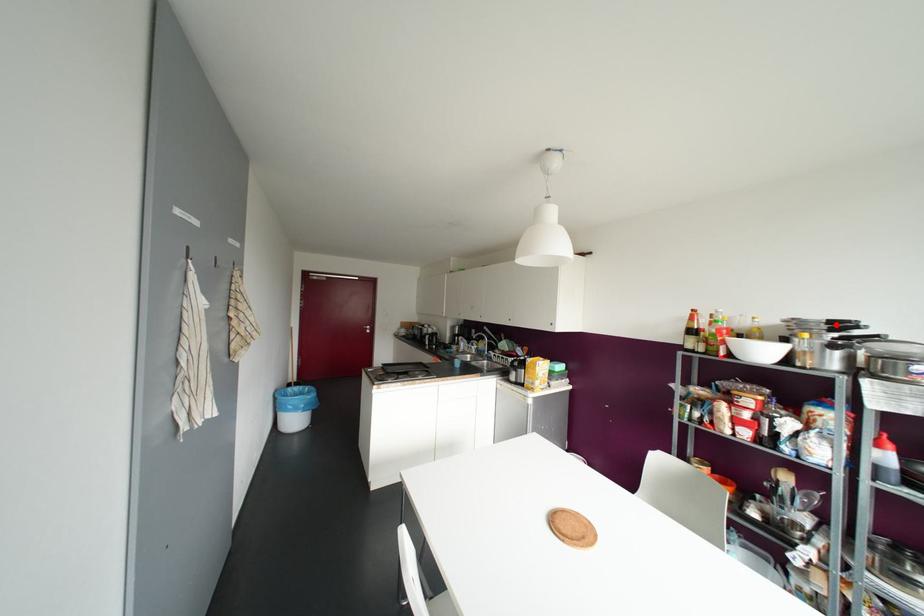
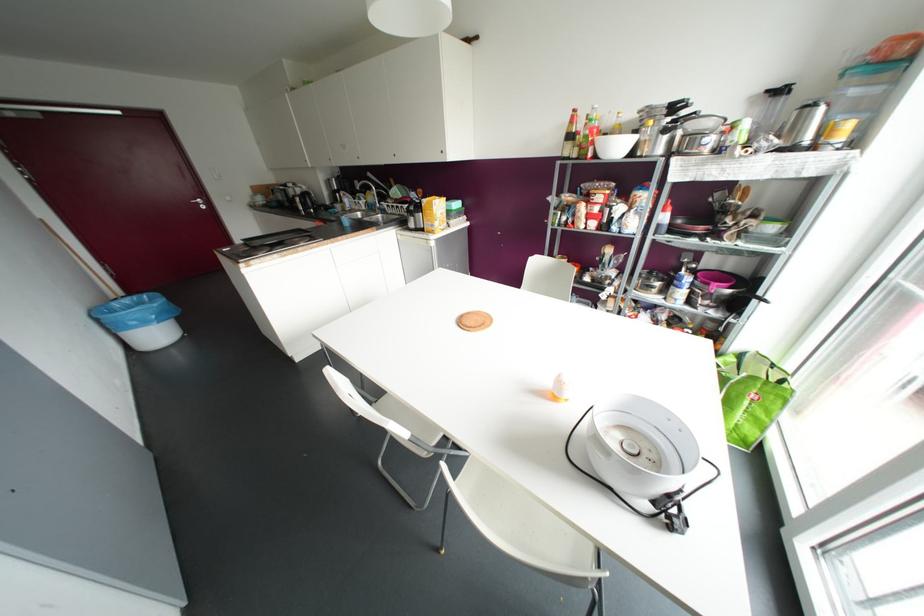
In the second image, find the point that corresponds to the highlighted location in the first image.

(673, 107)